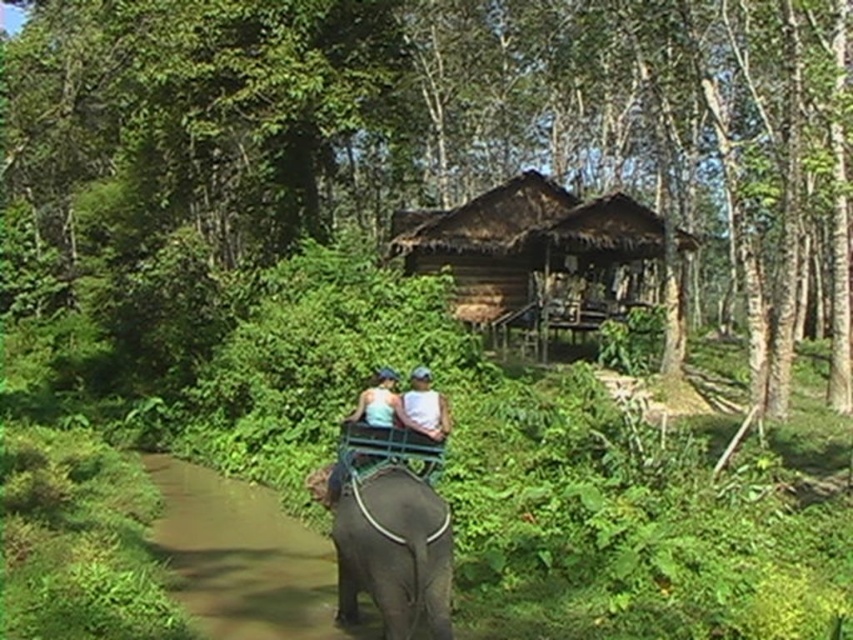
Question: Does brown dirt path at lower left appear on the left side of white matte shirt at center?

Choices:
 (A) no
 (B) yes

Answer: (B)

Question: Can you confirm if brown dirt path at lower left is positioned to the right of white matte shirt at center?

Choices:
 (A) yes
 (B) no

Answer: (B)

Question: Which of these objects is positioned closest to the brown thatch hut at center?

Choices:
 (A) green leafy tree at center
 (B) gray matte elephant at lower center

Answer: (A)

Question: Observing the image, what is the correct spatial positioning of green leafy tree at center in reference to brown thatch hut at center?

Choices:
 (A) below
 (B) above

Answer: (B)

Question: Which point is closer to the camera taking this photo?

Choices:
 (A) (469, 220)
 (B) (404, 541)
 (C) (383, 420)
 (D) (289, 600)

Answer: (B)

Question: Based on their relative distances, which object is farther from the brown dirt path at lower left?

Choices:
 (A) gray matte elephant at lower center
 (B) green leafy tree at center
 (C) white matte tank top at center

Answer: (B)